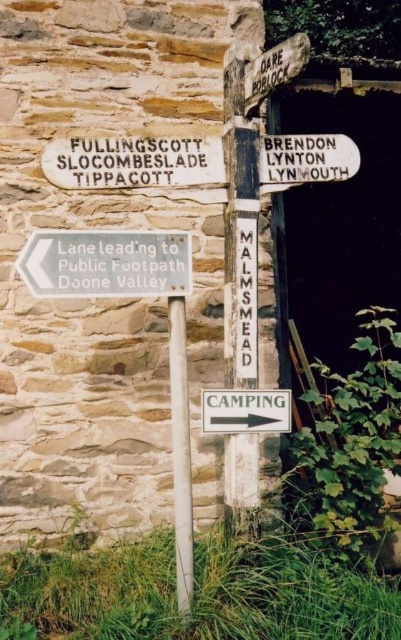
Where is `white plastic sign at lower left`? This screenshot has width=401, height=640. white plastic sign at lower left is located at coordinates (107, 262).

Is point (143, 280) positioned before point (320, 148)?

Yes.

Is point (101, 275) closer to camera compared to point (346, 166)?

That is True.

This screenshot has height=640, width=401. Identify the location of white plastic sign at lower left. (107, 262).

Is white wooden sign at upper right taller than white wooden sign at lower right?

Yes.

Based on the photo, which is more to the right, white wooden sign at upper right or white wooden sign at lower right?

From the viewer's perspective, white wooden sign at upper right appears more on the right side.

Does point (350, 140) come closer to viewer compared to point (251, 410)?

No.

At what (x,y) coordinates should I click in order to perform the action: click on white wooden sign at upper right. Please return your answer as a coordinate pair (x, y). The height and width of the screenshot is (640, 401). Looking at the image, I should click on (307, 157).

Does white wooden sign at lower right have a smaller size compared to wooden signpost at upper center?

Yes, white wooden sign at lower right is smaller than wooden signpost at upper center.

Can you confirm if white wooden sign at lower right is taller than wooden signpost at upper center?

In fact, white wooden sign at lower right may be shorter than wooden signpost at upper center.

Where is `white wooden sign at lower right`? The image size is (401, 640). white wooden sign at lower right is located at coordinates (245, 410).

This screenshot has height=640, width=401. In order to click on white wooden sign at lower right in this screenshot , I will do `click(245, 410)`.